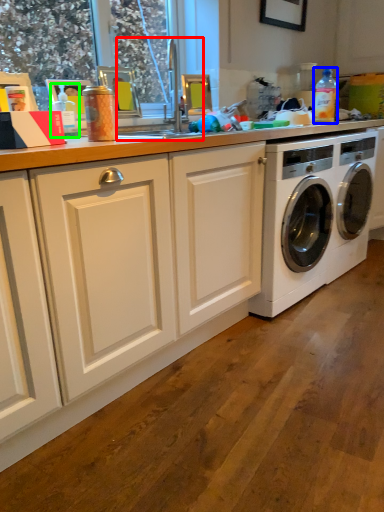
Question: Considering the real-world distances, which object is farthest from sink (highlighted by a red box)? bottle (highlighted by a blue box) or bottle (highlighted by a green box)?

Choices:
 (A) bottle
 (B) bottle

Answer: (A)